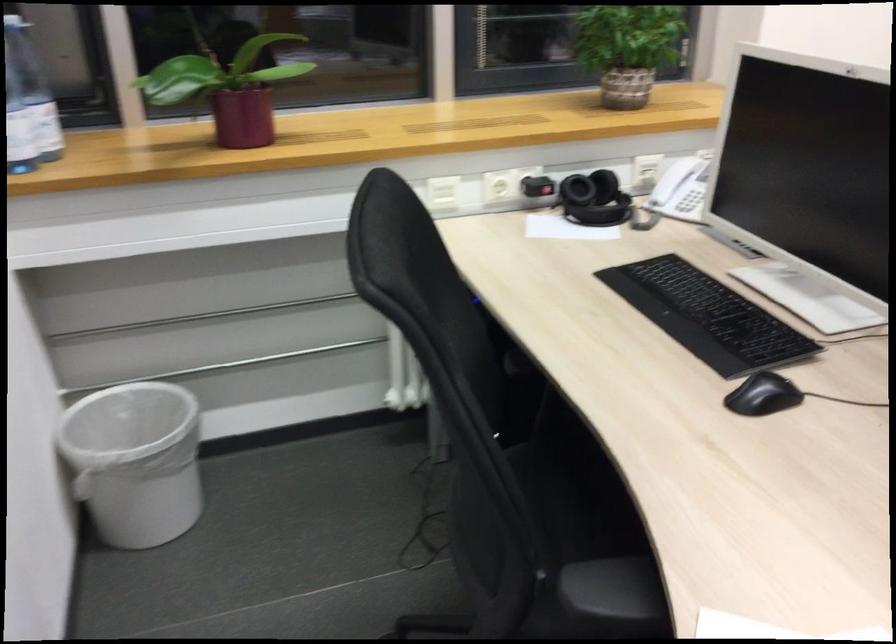
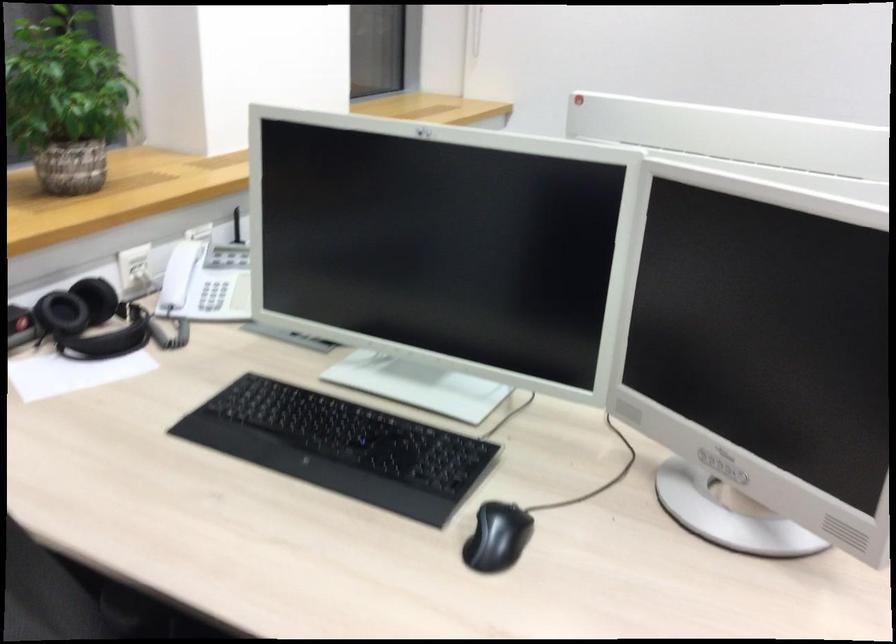
Question: The first image is from the beginning of the video and the second image is from the end. How did the camera likely rotate when shooting the video?

Choices:
 (A) Left
 (B) Right
 (C) Up
 (D) Down

Answer: (B)